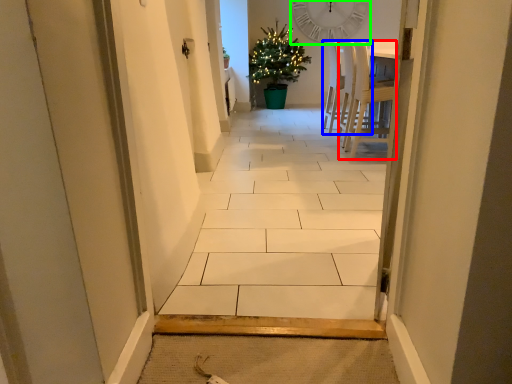
Question: Based on their relative distances, which object is nearer to chair (highlighted by a red box)? Choose from chair (highlighted by a blue box) and clock (highlighted by a green box).

Choices:
 (A) chair
 (B) clock

Answer: (A)